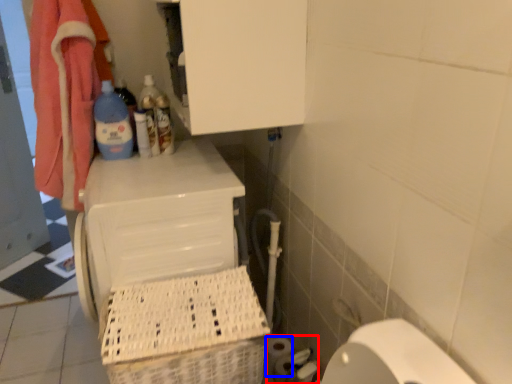
Question: Among these objects, which one is nearest to the camera, toilet paper (highlighted by a red box) or toilet paper (highlighted by a blue box)?

Choices:
 (A) toilet paper
 (B) toilet paper

Answer: (A)